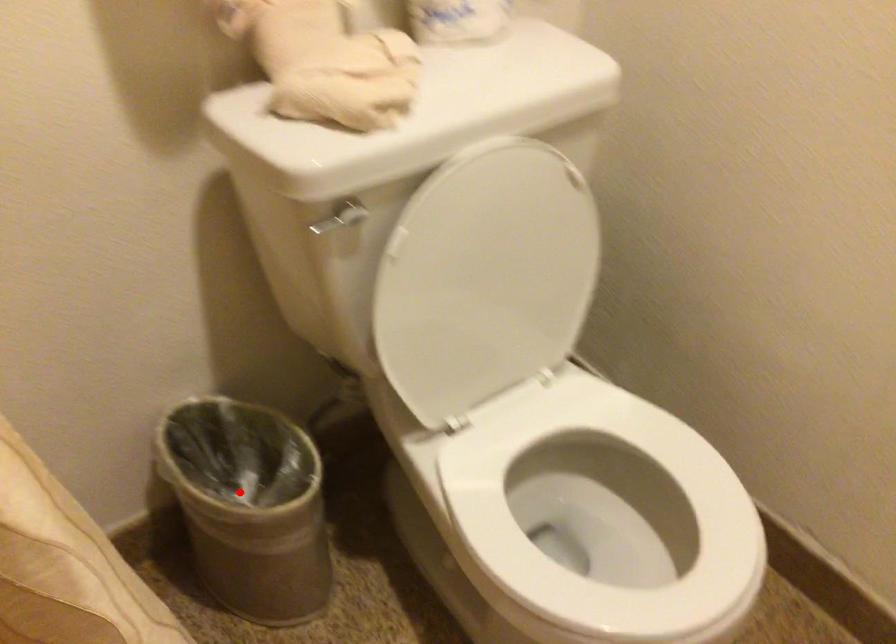
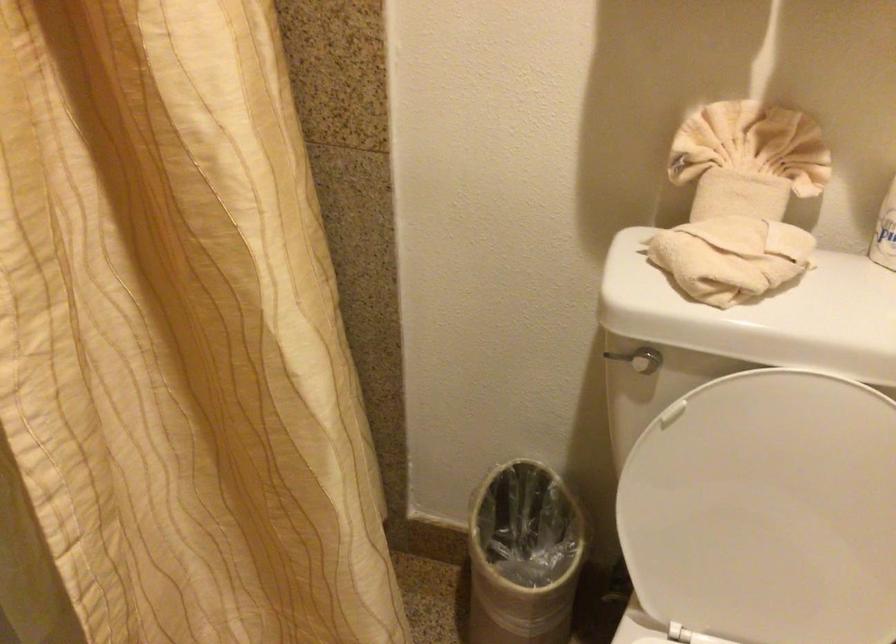
The point at the highlighted location is marked in the first image. Where is the corresponding point in the second image?

(522, 556)